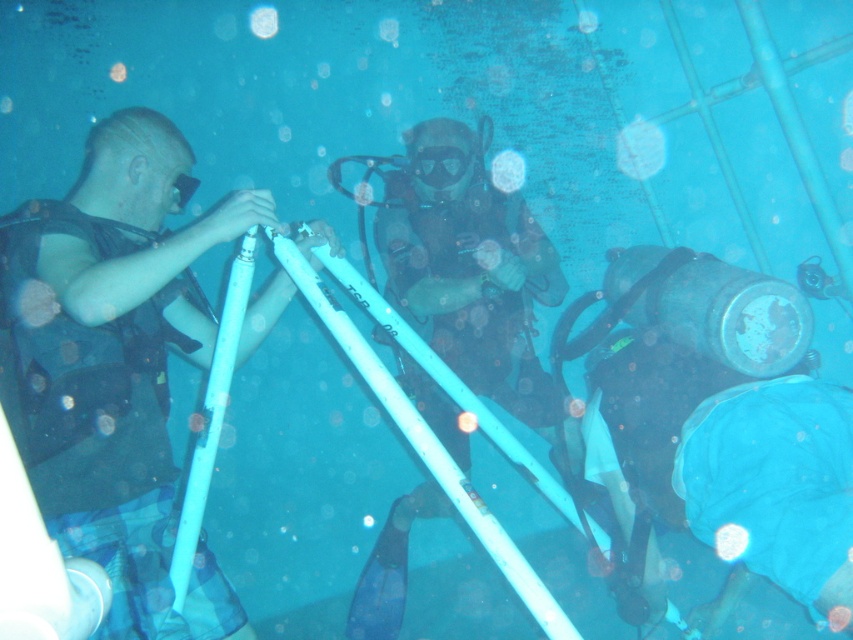
Question: Among these objects, which one is nearest to the camera?

Choices:
 (A) matte black vest at left
 (B) transparent plastic bubble at upper center

Answer: (A)

Question: Which point is farther to the camera?

Choices:
 (A) transparent plastic bubble at upper center
 (B) matte black vest at left

Answer: (A)

Question: Observing the image, what is the correct spatial positioning of matte black vest at left in reference to transparent plastic bubble at upper center?

Choices:
 (A) above
 (B) below

Answer: (B)

Question: Does matte black vest at left have a smaller size compared to transparent plastic bubble at upper center?

Choices:
 (A) yes
 (B) no

Answer: (B)

Question: Which point is closer to the camera?

Choices:
 (A) transparent rubber mask at center
 (B) transparent plastic bubble at upper center
 (C) matte black vest at left

Answer: (C)

Question: Does matte black vest at left appear over transparent plastic bubble at upper center?

Choices:
 (A) yes
 (B) no

Answer: (B)